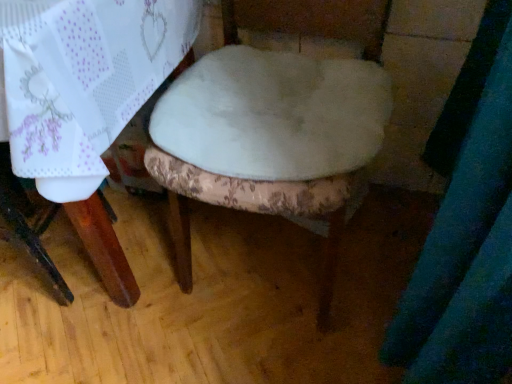
Question: From the image's perspective, is white fabric chair at center located above or below white fabric at center?

Choices:
 (A) below
 (B) above

Answer: (A)

Question: Considering the relative positions of white fabric chair at center and white fabric at center in the image provided, is white fabric chair at center to the left or to the right of white fabric at center?

Choices:
 (A) right
 (B) left

Answer: (A)

Question: Looking at the image, does white fabric chair at center seem bigger or smaller compared to white fabric at center?

Choices:
 (A) small
 (B) big

Answer: (B)

Question: Is white fabric at center taller or shorter than white fabric chair at center?

Choices:
 (A) tall
 (B) short

Answer: (B)

Question: Considering the positions of white fabric at center and white fabric chair at center in the image, is white fabric at center wider or thinner than white fabric chair at center?

Choices:
 (A) wide
 (B) thin

Answer: (B)

Question: Relative to white fabric chair at center, is white fabric at center in front or behind?

Choices:
 (A) behind
 (B) front

Answer: (A)

Question: Visually, is white fabric at center positioned to the left or to the right of white fabric chair at center?

Choices:
 (A) left
 (B) right

Answer: (A)